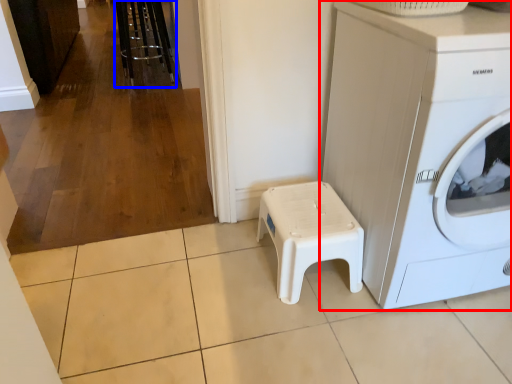
Question: Which object is further to the camera taking this photo, washing machine (highlighted by a red box) or bar stool (highlighted by a blue box)?

Choices:
 (A) washing machine
 (B) bar stool

Answer: (B)